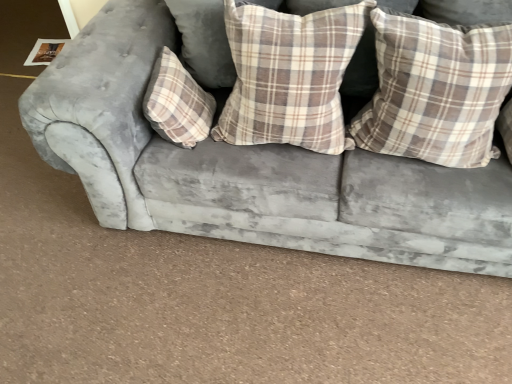
Question: Does velvet gray couch at center have a larger size compared to plaid fabric pillow at center, the 2th pillow from the right?

Choices:
 (A) no
 (B) yes

Answer: (B)

Question: Is velvet gray couch at center thinner than plaid fabric pillow at center, the second pillow when ordered from left to right?

Choices:
 (A) yes
 (B) no

Answer: (B)

Question: Is velvet gray couch at center not near plaid fabric pillow at center, the second pillow when ordered from left to right?

Choices:
 (A) no
 (B) yes

Answer: (A)

Question: Does velvet gray couch at center come behind plaid fabric pillow at center, the 2th pillow from the right?

Choices:
 (A) no
 (B) yes

Answer: (A)

Question: Does velvet gray couch at center have a lesser height compared to plaid fabric pillow at center, the 2th pillow from the right?

Choices:
 (A) no
 (B) yes

Answer: (A)

Question: In the image, is plaid fabric pillow at center, the second pillow when ordered from left to right, on the left side or the right side of velvet gray couch at center?

Choices:
 (A) right
 (B) left

Answer: (B)

Question: In terms of size, does plaid fabric pillow at center, the 2th pillow from the right, appear bigger or smaller than velvet gray couch at center?

Choices:
 (A) big
 (B) small

Answer: (B)

Question: Looking at their shapes, would you say plaid fabric pillow at center, the second pillow when ordered from left to right, is wider or thinner than velvet gray couch at center?

Choices:
 (A) wide
 (B) thin

Answer: (B)

Question: Considering the positions of plaid fabric pillow at center, the 2th pillow from the right, and velvet gray couch at center in the image, is plaid fabric pillow at center, the 2th pillow from the right, taller or shorter than velvet gray couch at center?

Choices:
 (A) tall
 (B) short

Answer: (B)

Question: Is velvet gray couch at center taller or shorter than plaid fabric pillow at center, the second pillow when ordered from left to right?

Choices:
 (A) short
 (B) tall

Answer: (B)

Question: Is velvet gray couch at center bigger or smaller than plaid fabric pillow at center, the 2th pillow from the right?

Choices:
 (A) big
 (B) small

Answer: (A)

Question: From the image's perspective, is velvet gray couch at center above or below plaid fabric pillow at center, the 2th pillow from the right?

Choices:
 (A) above
 (B) below

Answer: (B)

Question: Is velvet gray couch at center wider or thinner than plaid fabric pillow at center, the second pillow when ordered from left to right?

Choices:
 (A) thin
 (B) wide

Answer: (B)

Question: Is point (159, 114) closer or farther from the camera than point (34, 140)?

Choices:
 (A) farther
 (B) closer

Answer: (B)

Question: From their relative heights in the image, would you say plaid fabric pillow at center, the third pillow positioned from the right, is taller or shorter than velvet gray couch at center?

Choices:
 (A) short
 (B) tall

Answer: (A)